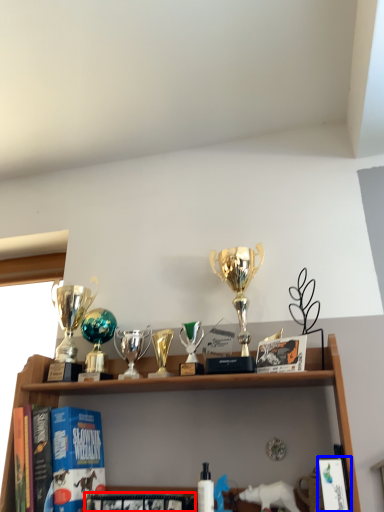
Question: Among these objects, which one is nearest to the camera, book (highlighted by a red box) or book (highlighted by a blue box)?

Choices:
 (A) book
 (B) book

Answer: (B)